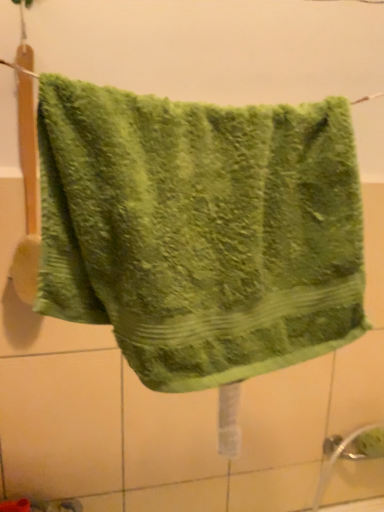
Question: Is white matte tile at lower left smaller than green fluffy towel at center?

Choices:
 (A) yes
 (B) no

Answer: (A)

Question: From a real-world perspective, does white matte tile at lower left sit lower than green fluffy towel at center?

Choices:
 (A) yes
 (B) no

Answer: (A)

Question: Is white matte tile at lower left thinner than green fluffy towel at center?

Choices:
 (A) no
 (B) yes

Answer: (B)

Question: Can you confirm if white matte tile at lower left is wider than green fluffy towel at center?

Choices:
 (A) no
 (B) yes

Answer: (A)

Question: Is white matte tile at lower left closer to camera compared to green fluffy towel at center?

Choices:
 (A) yes
 (B) no

Answer: (B)

Question: Is white matte tile at lower left not within green fluffy towel at center?

Choices:
 (A) yes
 (B) no

Answer: (A)

Question: Is green fluffy towel at center next to white matte tile at lower left and touching it?

Choices:
 (A) yes
 (B) no

Answer: (B)

Question: From the image's perspective, is green fluffy towel at center below white matte tile at lower left?

Choices:
 (A) no
 (B) yes

Answer: (A)

Question: Can you confirm if green fluffy towel at center is bigger than white matte tile at lower left?

Choices:
 (A) no
 (B) yes

Answer: (B)

Question: Can you confirm if green fluffy towel at center is taller than white matte tile at lower left?

Choices:
 (A) yes
 (B) no

Answer: (B)

Question: Could you tell me if green fluffy towel at center is facing white matte tile at lower left?

Choices:
 (A) no
 (B) yes

Answer: (A)

Question: Is green fluffy towel at center smaller than white matte tile at lower left?

Choices:
 (A) yes
 (B) no

Answer: (B)

Question: Is point (284, 279) closer or farther from the camera than point (114, 448)?

Choices:
 (A) closer
 (B) farther

Answer: (A)